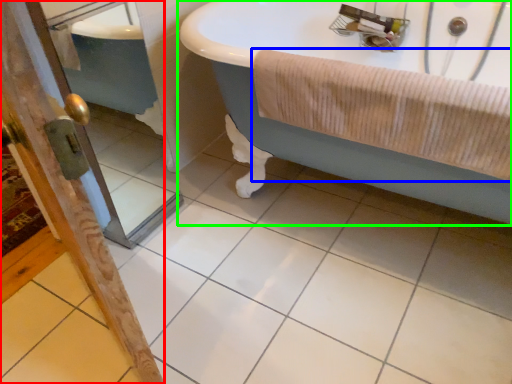
Question: Based on their relative distances, which object is nearer to screen door (highlighted by a red box)? Choose from bath towel (highlighted by a blue box) and bathtub (highlighted by a green box).

Choices:
 (A) bath towel
 (B) bathtub

Answer: (A)